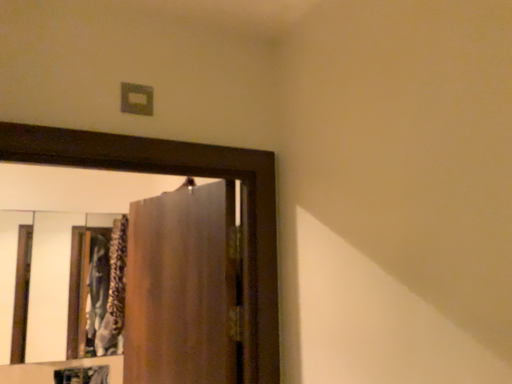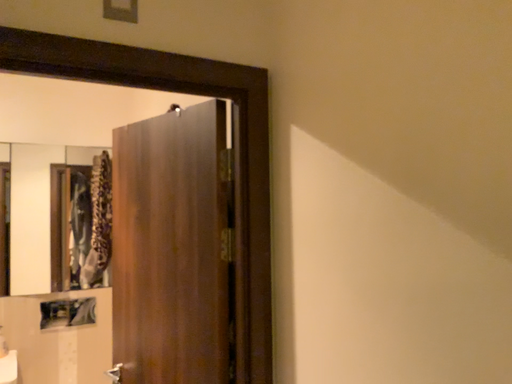
Question: Which way did the camera rotate in the video?

Choices:
 (A) rotated downward
 (B) rotated upward

Answer: (A)